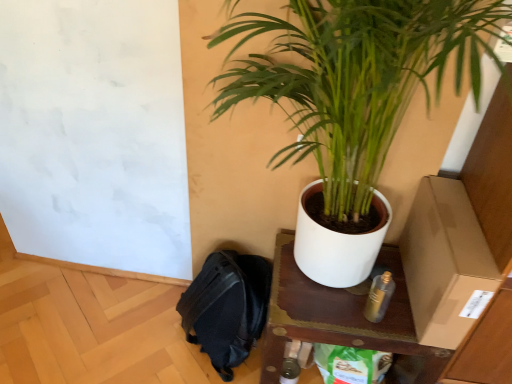
This screenshot has height=384, width=512. What are the coordinates of `free spot above brown cardboard box at right (from a real-world perspective)` in the screenshot? It's located at (458, 223).